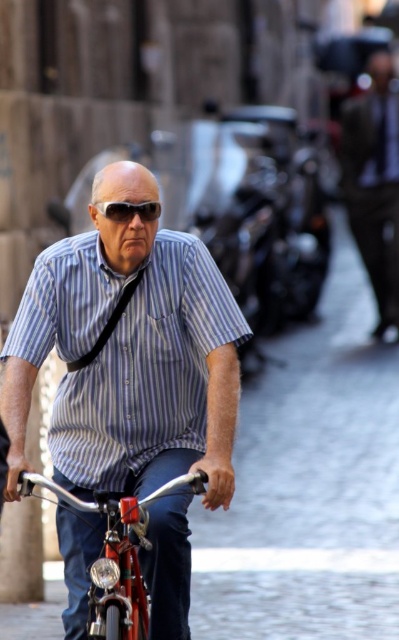
Between point (154, 292) and point (367, 150), which one is positioned behind?

Point (367, 150)

The height and width of the screenshot is (640, 399). Describe the element at coordinates (128, 355) in the screenshot. I see `blue striped shirt at center` at that location.

Identify the location of blue striped shirt at center. (128, 355).

Who is more distant from viewer, (193, 492) or (98, 211)?

Point (98, 211)

Locate an element on the screen. This screenshot has height=640, width=399. shiny metallic bicycle at center is located at coordinates coord(116,554).

Between dark brown leather jacket at upper right and shiny metallic bicycle at center, which one is positioned higher?

Positioned higher is dark brown leather jacket at upper right.

Is dark brown leather jacket at upper right above shiny metallic bicycle at center?

Correct, dark brown leather jacket at upper right is located above shiny metallic bicycle at center.

The image size is (399, 640). Describe the element at coordinates (375, 182) in the screenshot. I see `dark brown leather jacket at upper right` at that location.

The height and width of the screenshot is (640, 399). What are the coordinates of `dark brown leather jacket at upper right` in the screenshot? It's located at (375, 182).